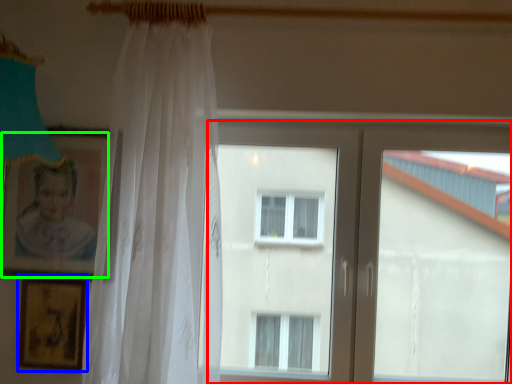
Question: Which object is positioned closest to window (highlighted by a red box)? Select from picture frame (highlighted by a blue box) and picture frame (highlighted by a green box).

Choices:
 (A) picture frame
 (B) picture frame

Answer: (B)